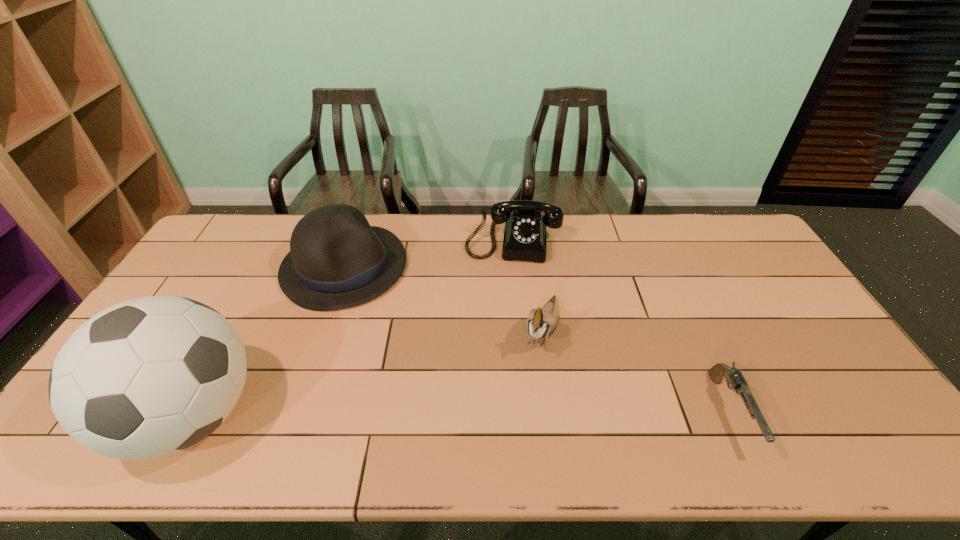
The width and height of the screenshot is (960, 540). I want to click on the tallest object, so click(x=148, y=377).

Where is `gun`? Image resolution: width=960 pixels, height=540 pixels. gun is located at coordinates (735, 378).

You are a GUI agent. You are given a task and a screenshot of the screen. Output one action in this format:
    pyautogui.click(x=<x>, y=<y>)
    Task: Click on the rightmost object
    
    Given the screenshot: What is the action you would take?
    pyautogui.click(x=735, y=378)

Identify the location of bird. (541, 323).

Locate an element on the screen. This screenshot has width=960, height=540. bowler hat is located at coordinates tap(337, 260).

Locate an element on the screen. the second shortest object is located at coordinates (524, 239).

At what (x,y) coordinates should I click in order to perform the action: click on vacant point located on the right of the soccer ball. Please return your answer as a coordinate pair (x, y). The image size is (960, 540). Looking at the image, I should click on (356, 416).

Where is `free space located at the face of the bird`? free space located at the face of the bird is located at coordinates (525, 402).

Locate an element on the screen. This screenshot has height=540, width=960. vacant space located at the face of the bird is located at coordinates (527, 399).

Identify the location of free spot located at the face of the bird. (525, 402).